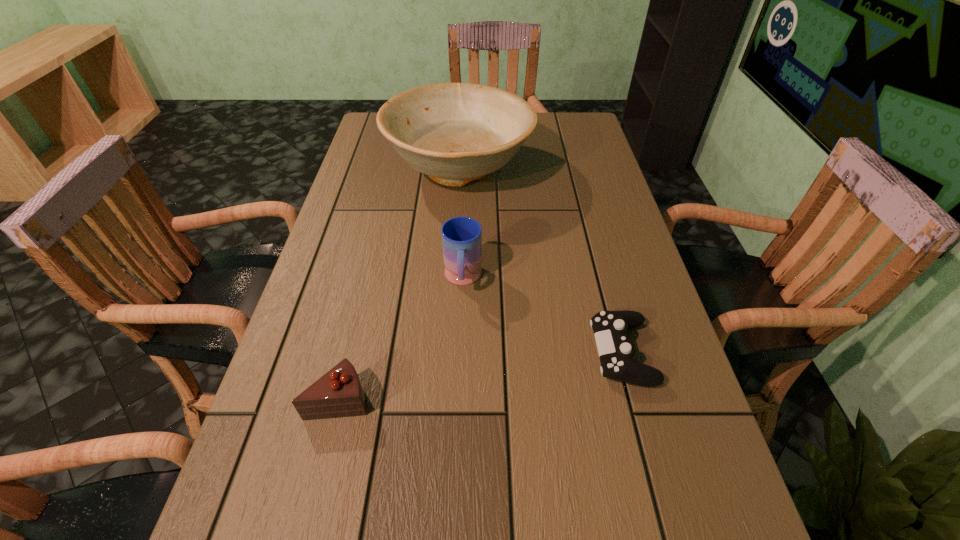
In the image, there is a desktop. Where is `free region at the right edge`? free region at the right edge is located at coordinates point(606,176).

In the image, there is a desktop. Where is `free space at the far left corner`? This screenshot has height=540, width=960. free space at the far left corner is located at coordinates (387, 145).

You are a GUI agent. You are given a task and a screenshot of the screen. Output one action in this format:
    pyautogui.click(x=<x>, y=<y>)
    Task: Click on the vacant space at the far right corner
    The width and height of the screenshot is (960, 540).
    Given the screenshot: What is the action you would take?
    pyautogui.click(x=551, y=140)

You are a GUI agent. You are given a task and a screenshot of the screen. Output one action in this format:
    pyautogui.click(x=<x>, y=<y>)
    Task: Click on the vacant space that's between the farthest object and the farther chocolate cake
    This screenshot has width=960, height=540.
    Given the screenshot: What is the action you would take?
    pyautogui.click(x=399, y=284)

Where is `free space between the fourth tallest object and the tallest object`? This screenshot has height=540, width=960. free space between the fourth tallest object and the tallest object is located at coordinates (540, 261).

Locate an element on the screen. This screenshot has height=540, width=960. unoccupied area between the control and the farthest object is located at coordinates (540, 261).

The height and width of the screenshot is (540, 960). In order to click on free space between the control and the left chocolate cake in this screenshot , I will do `click(481, 375)`.

The image size is (960, 540). Find the location of `free space between the second shortest object and the second tallest object`. free space between the second shortest object and the second tallest object is located at coordinates (542, 316).

Locate an element on the screen. The image size is (960, 540). vacant space in between the left chocolate cake and the control is located at coordinates (481, 375).

What are the coordinates of `vacant area that lies between the farthest object and the second shortest object` in the screenshot? It's located at (540, 261).